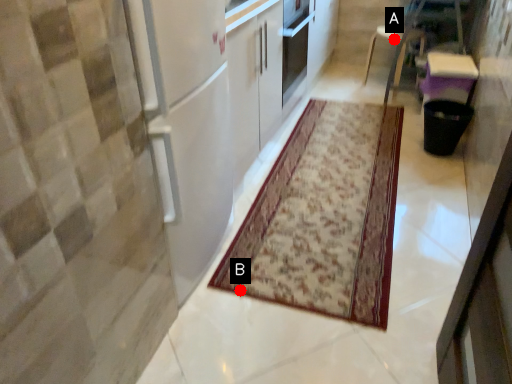
Question: Two points are circled on the image, labeled by A and B beside each circle. Which point is farther from the camera taking this photo?

Choices:
 (A) A is further
 (B) B is further

Answer: (A)